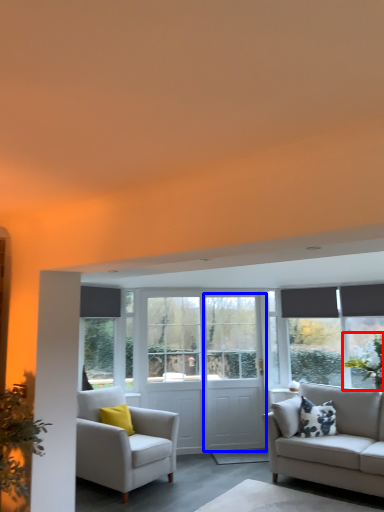
Question: Which of the following is the farthest to the observer, plant (highlighted by a red box) or screen door (highlighted by a blue box)?

Choices:
 (A) plant
 (B) screen door

Answer: (B)